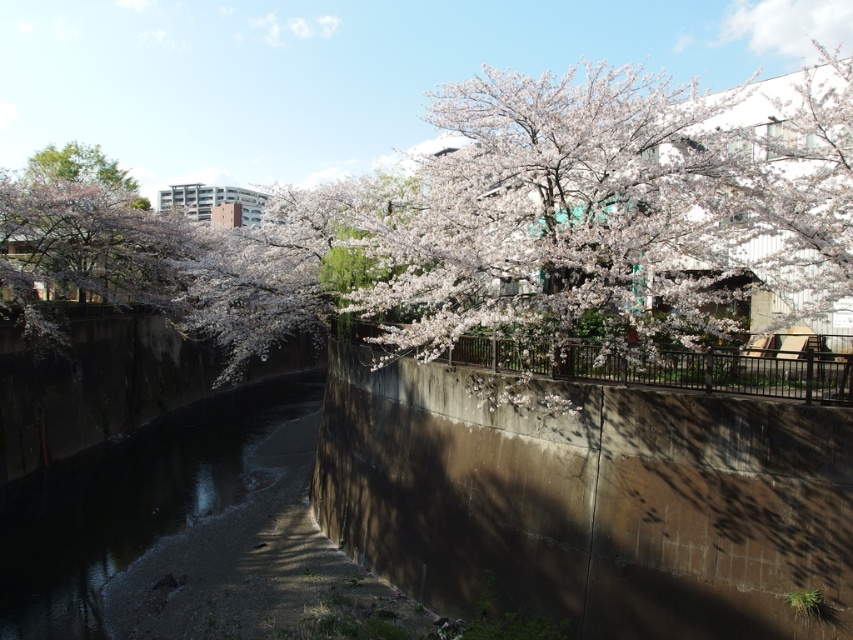
Question: Is white blossoms at upper center positioned before pink blossoms at left?

Choices:
 (A) yes
 (B) no

Answer: (A)

Question: Estimate the real-world distances between objects in this image. Which object is farther from the pink blossoms at left?

Choices:
 (A) dark concrete river at center
 (B) white blossoms at upper center

Answer: (A)

Question: Which object is farther from the camera taking this photo?

Choices:
 (A) dark concrete river at center
 (B) pink blossoms at left
 (C) white blossoms at upper center

Answer: (B)

Question: Observing the image, what is the correct spatial positioning of white blossoms at upper center in reference to pink blossoms at left?

Choices:
 (A) below
 (B) above

Answer: (A)

Question: Can you confirm if white blossoms at upper center is thinner than pink blossoms at left?

Choices:
 (A) no
 (B) yes

Answer: (A)

Question: Which point is farther from the camera taking this photo?

Choices:
 (A) (120, 184)
 (B) (840, 278)

Answer: (A)